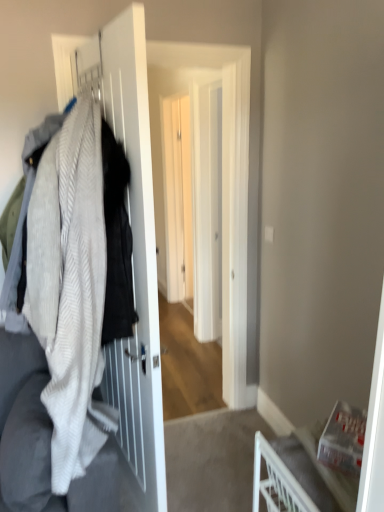
What do you see at coordinates (137, 262) in the screenshot?
I see `textured wool sweater at left` at bounding box center [137, 262].

In order to click on white matte screen door at left, the first screen door from the front in this screenshot , I will do tap(136, 261).

Locate an element on the screen. white plastic chair at lower right is located at coordinates (299, 477).

What do you see at coordinates (69, 286) in the screenshot? I see `white textured blanket at left` at bounding box center [69, 286].

Find the location of a particular element. textured wool sweater at left is located at coordinates (137, 262).

From the image's perspective, is textured wool sweater at left over white matte screen door at left, which appears as the 2th screen door when viewed from the back?

Correct, textured wool sweater at left appears higher than white matte screen door at left, which appears as the 2th screen door when viewed from the back, in the image.

Is textured wool sweater at left not near white matte screen door at left, the first screen door from the front?

Actually, textured wool sweater at left and white matte screen door at left, the first screen door from the front, are a little close together.

Which is less distant, (107,383) or (135,161)?

Point (107,383) appears to be farther away from the viewer than point (135,161).

Are white textured blanket at left and textured wool sweater at left located far from each other?

No.

Considering the relative positions of white textured blanket at left and textured wool sweater at left in the image provided, is white textured blanket at left to the left of textured wool sweater at left from the viewer's perspective?

Correct, you'll find white textured blanket at left to the left of textured wool sweater at left.

Is white textured blanket at left shorter than textured wool sweater at left?

Yes.

Which of these two, white textured blanket at left or textured wool sweater at left, is thinner?

textured wool sweater at left is thinner.

Is white matte screen door at left, the first screen door from the front, at the back of white plastic chair at lower right?

No, white plastic chair at lower right's orientation is not away from white matte screen door at left, the first screen door from the front.

This screenshot has height=512, width=384. Find the location of `furniture in front of the white matte screen door at left, the first screen door from the front`. furniture in front of the white matte screen door at left, the first screen door from the front is located at coordinates (299, 477).

Is white plastic chair at lower right not within white matte screen door at left, the first screen door from the front?

white plastic chair at lower right lies outside white matte screen door at left, the first screen door from the front,'s area.

Which is closer to the camera, (266, 502) or (118, 110)?

Point (266, 502) appears to be farther away from the viewer than point (118, 110).

Is white matte screen door at left, the first screen door from the front, to the right of white glossy screen door at center, which is the 2th screen door in front-to-back order, from the viewer's perspective?

No, white matte screen door at left, the first screen door from the front, is not to the right of white glossy screen door at center, which is the 2th screen door in front-to-back order.

Which is in front, white matte screen door at left, the first screen door from the front, or white glossy screen door at center, acting as the first screen door starting from the back?

white matte screen door at left, the first screen door from the front.

Is white matte screen door at left, the first screen door from the front, shorter than white glossy screen door at center, acting as the first screen door starting from the back?

Yes.

Does white glossy screen door at center, acting as the first screen door starting from the back, touch white plastic chair at lower right?

No, white glossy screen door at center, acting as the first screen door starting from the back, is not touching white plastic chair at lower right.

Who is more distant, white glossy screen door at center, which is the 2th screen door in front-to-back order, or white plastic chair at lower right?

white glossy screen door at center, which is the 2th screen door in front-to-back order, is further from the camera.

Does white glossy screen door at center, acting as the first screen door starting from the back, appear on the left side of white plastic chair at lower right?

Indeed, white glossy screen door at center, acting as the first screen door starting from the back, is positioned on the left side of white plastic chair at lower right.

Is white glossy screen door at center, which is the 2th screen door in front-to-back order, aimed at white plastic chair at lower right?

No, white glossy screen door at center, which is the 2th screen door in front-to-back order, is not aimed at white plastic chair at lower right.

From a real-world perspective, is white glossy screen door at center, which is the 2th screen door in front-to-back order, over white matte screen door at left, the first screen door from the front?

Yes, from a real-world perspective, white glossy screen door at center, which is the 2th screen door in front-to-back order, is above white matte screen door at left, the first screen door from the front.

Which is correct: white glossy screen door at center, acting as the first screen door starting from the back, is inside white matte screen door at left, which appears as the 2th screen door when viewed from the back, or outside of it?

white glossy screen door at center, acting as the first screen door starting from the back, is outside white matte screen door at left, which appears as the 2th screen door when viewed from the back.

Considering the sizes of white glossy screen door at center, which is the 2th screen door in front-to-back order, and white matte screen door at left, the first screen door from the front, in the image, is white glossy screen door at center, which is the 2th screen door in front-to-back order, taller or shorter than white matte screen door at left, the first screen door from the front,?

Considering their sizes, white glossy screen door at center, which is the 2th screen door in front-to-back order, has more height than white matte screen door at left, the first screen door from the front.

Is point (161, 471) in front of point (40, 279)?

No, (161, 471) is behind (40, 279).

From the image's perspective, which one is positioned lower, textured wool sweater at left or white textured blanket at left?

textured wool sweater at left is shown below in the image.

What are the coordinates of `closet below the white textured blanket at left (from the image's perspective)` in the screenshot? It's located at (137, 262).

Between textured wool sweater at left and white textured blanket at left, which one appears on the right side from the viewer's perspective?

From the viewer's perspective, textured wool sweater at left appears more on the right side.

From the textured wool sweater at left, count 1st screen door to the right and point to it. Please provide its 2D coordinates.

[(136, 261)]

What are the coordinates of `blanket above the textured wool sweater at left (from a real-world perspective)` in the screenshot? It's located at (69, 286).

Looking at the image, which one is located closer to white plastic chair at lower right, textured wool sweater at left or white matte screen door at left, the first screen door from the front?

The object closer to white plastic chair at lower right is textured wool sweater at left.

Consider the image. When comparing their distances from white glossy screen door at center, acting as the first screen door starting from the back, does white matte screen door at left, which appears as the 2th screen door when viewed from the back, or white textured blanket at left seem closer?

white matte screen door at left, which appears as the 2th screen door when viewed from the back.

Which object lies nearer to the anchor point white plastic chair at lower right, white textured blanket at left or textured wool sweater at left?

Based on the image, textured wool sweater at left appears to be nearer to white plastic chair at lower right.

From the image, which object appears to be nearer to white glossy screen door at center, acting as the first screen door starting from the back, white plastic chair at lower right or textured wool sweater at left?

textured wool sweater at left is positioned closer to the anchor white glossy screen door at center, acting as the first screen door starting from the back.

Based on the photo, from the image, which object appears to be farther from white glossy screen door at center, acting as the first screen door starting from the back, white matte screen door at left, the first screen door from the front, or white plastic chair at lower right?

white plastic chair at lower right is further to white glossy screen door at center, acting as the first screen door starting from the back.

Which object lies further to the anchor point white matte screen door at left, which appears as the 2th screen door when viewed from the back, white plastic chair at lower right or white textured blanket at left?

white plastic chair at lower right.

From the image, which object appears to be nearer to white glossy screen door at center, which is the 2th screen door in front-to-back order, white matte screen door at left, which appears as the 2th screen door when viewed from the back, or textured wool sweater at left?

white matte screen door at left, which appears as the 2th screen door when viewed from the back, is closer to white glossy screen door at center, which is the 2th screen door in front-to-back order.

Estimate the real-world distances between objects in this image. Which object is closer to white textured blanket at left, white matte screen door at left, the first screen door from the front, or white plastic chair at lower right?

white matte screen door at left, the first screen door from the front.

At what (x,y) coordinates should I click in order to perform the action: click on screen door between white plastic chair at lower right and white glossy screen door at center, which is the 2th screen door in front-to-back order, in the front-back direction. Please return your answer as a coordinate pair (x, y). The image size is (384, 512). Looking at the image, I should click on (136, 261).

The height and width of the screenshot is (512, 384). I want to click on screen door between textured wool sweater at left and white glossy screen door at center, which is the 2th screen door in front-to-back order, along the z-axis, so click(136, 261).

Where is `blanket located between white matte screen door at left, the first screen door from the front, and white glossy screen door at center, acting as the first screen door starting from the back, in the depth direction`? This screenshot has width=384, height=512. blanket located between white matte screen door at left, the first screen door from the front, and white glossy screen door at center, acting as the first screen door starting from the back, in the depth direction is located at coordinates (69, 286).

In order to click on furniture between textured wool sweater at left and white glossy screen door at center, acting as the first screen door starting from the back, along the z-axis in this screenshot , I will do `click(299, 477)`.